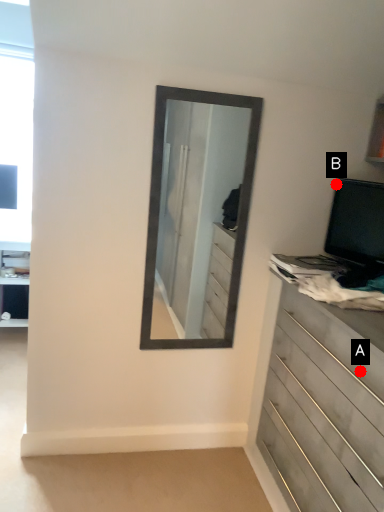
Question: Two points are circled on the image, labeled by A and B beside each circle. Which point is closer to the camera?

Choices:
 (A) A is closer
 (B) B is closer

Answer: (A)